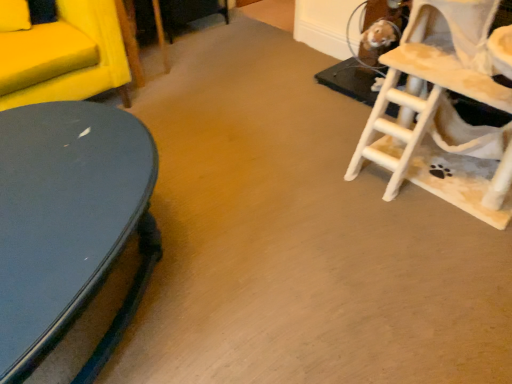
I want to click on free space above glossy dark blue table at left (from a real-world perspective), so click(x=57, y=169).